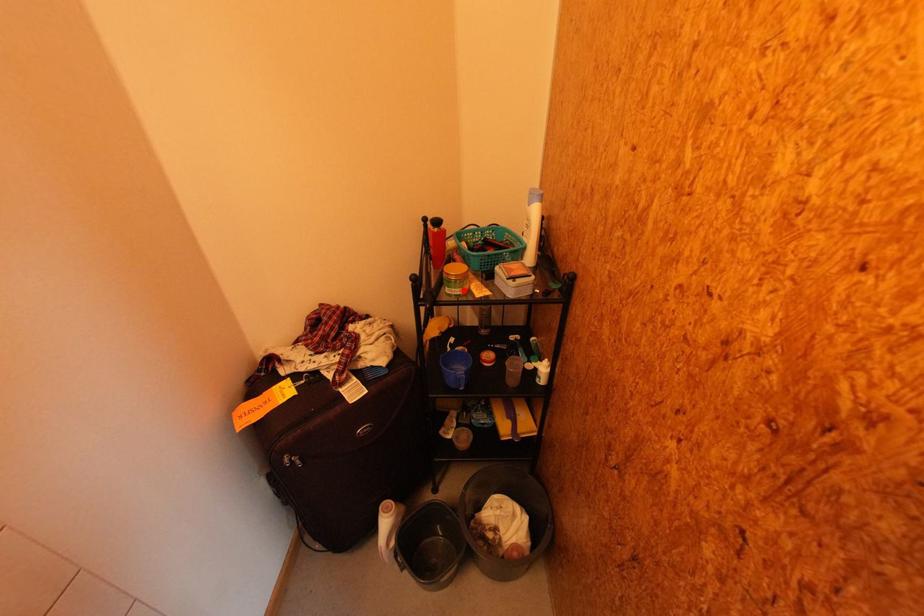
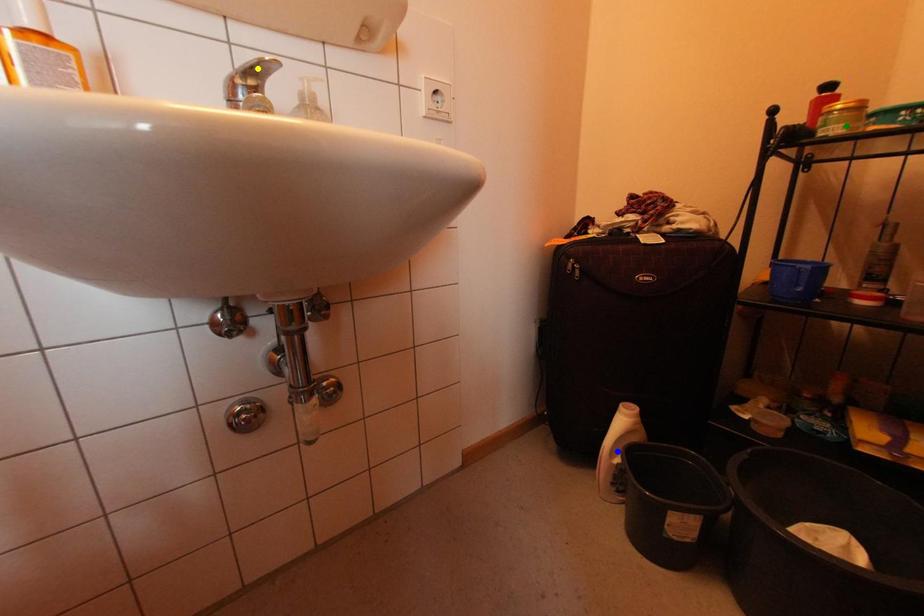
Question: I am providing you with two images of the same scene from different viewpoints. A red point is marked on the first image. You are given multiple points on the second image. Can you choose the point in image 2 that corresponds to the point in image 1?

Choices:
 (A) yellow point
 (B) blue point
 (C) green point

Answer: (C)